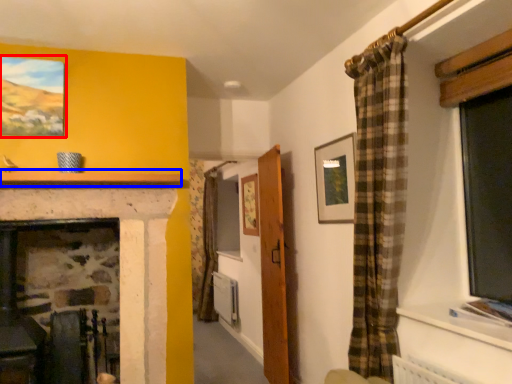
Question: Which object is further to the camera taking this photo, picture frame (highlighted by a red box) or mantle (highlighted by a blue box)?

Choices:
 (A) picture frame
 (B) mantle

Answer: (A)